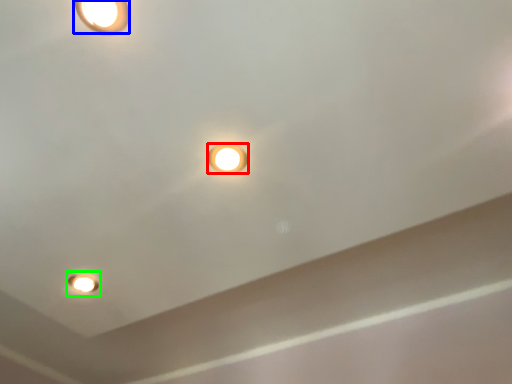
Question: Estimate the real-world distances between objects in this image. Which object is closer to lamp (highlighted by a red box), lamp (highlighted by a blue box) or light fixture (highlighted by a green box)?

Choices:
 (A) lamp
 (B) light fixture

Answer: (A)